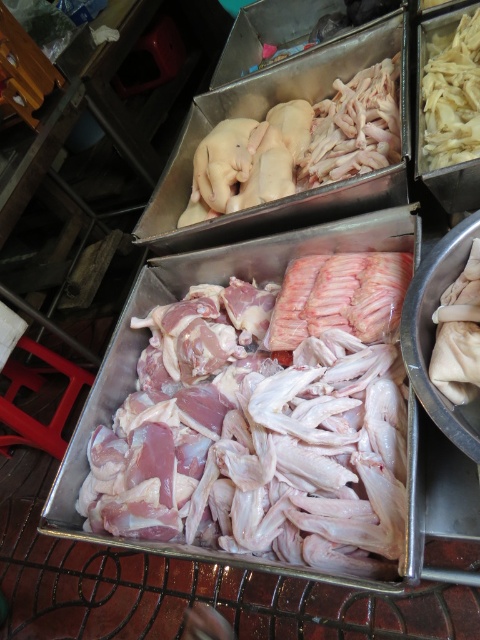
Question: Can you confirm if pale pink raw meat at upper center is positioned to the right of white matte noodles at upper right?

Choices:
 (A) yes
 (B) no

Answer: (B)

Question: Which of the following is the farthest from the observer?

Choices:
 (A) (363, 417)
 (B) (430, 67)
 (C) (279, 108)

Answer: (C)

Question: Which point is closer to the camera?

Choices:
 (A) (237, 205)
 (B) (433, 109)
 (C) (360, 374)

Answer: (C)

Question: Among these points, which one is farthest from the camera?

Choices:
 (A) (290, 189)
 (B) (466, 74)

Answer: (A)

Question: Is pale pink raw meat at upper center to the right of white matte noodles at upper right from the viewer's perspective?

Choices:
 (A) no
 (B) yes

Answer: (A)

Question: From the image, what is the correct spatial relationship of pink raw meat at center in relation to pale pink raw meat at upper center?

Choices:
 (A) left
 (B) right

Answer: (A)